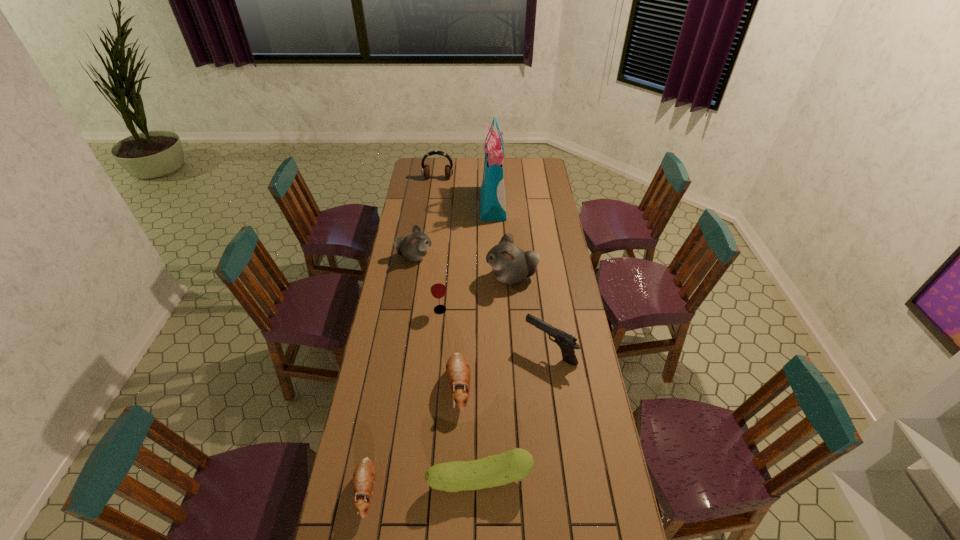
You are a GUI agent. You are given a task and a screenshot of the screen. Output one action in this format:
    pyautogui.click(x=<x>, y=<y>)
    Task: Click on the gun
    This screenshot has width=960, height=540.
    Given the screenshot: What is the action you would take?
    pyautogui.click(x=567, y=343)

Find the location of a particular element. The height and width of the screenshot is (540, 960). the right brown hamster is located at coordinates (458, 374).

This screenshot has height=540, width=960. I want to click on the third hamster from left to right, so click(458, 374).

This screenshot has width=960, height=540. Identify the location of cucumber. click(514, 465).

I want to click on the left brown hamster, so (364, 475).

The width and height of the screenshot is (960, 540). I want to click on the nearest hamster, so click(364, 475).

Locate an element on the screen. free spot located on the back of the shopping bag is located at coordinates point(492,176).

Locate an element on the screen. This screenshot has width=960, height=540. free spot located on the face of the tallest hamster is located at coordinates (434, 277).

Where is `vacant space located 0.050m on the face of the tallest hamster`? vacant space located 0.050m on the face of the tallest hamster is located at coordinates (475, 277).

At what (x,y) coordinates should I click in order to perform the action: click on vacant space located 0.060m on the face of the tallest hamster. Please return your answer as a coordinate pair (x, y). Image resolution: width=960 pixels, height=540 pixels. Looking at the image, I should click on (472, 277).